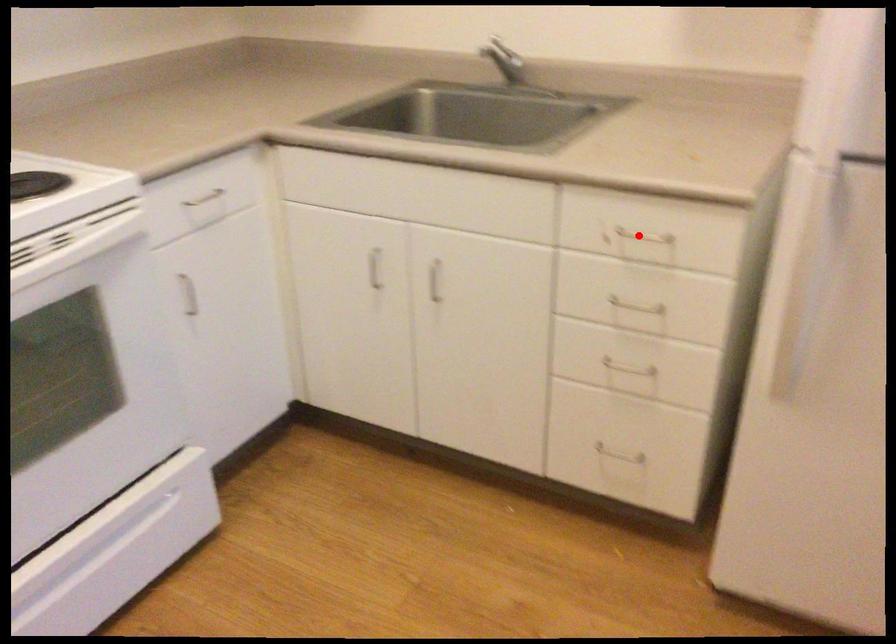
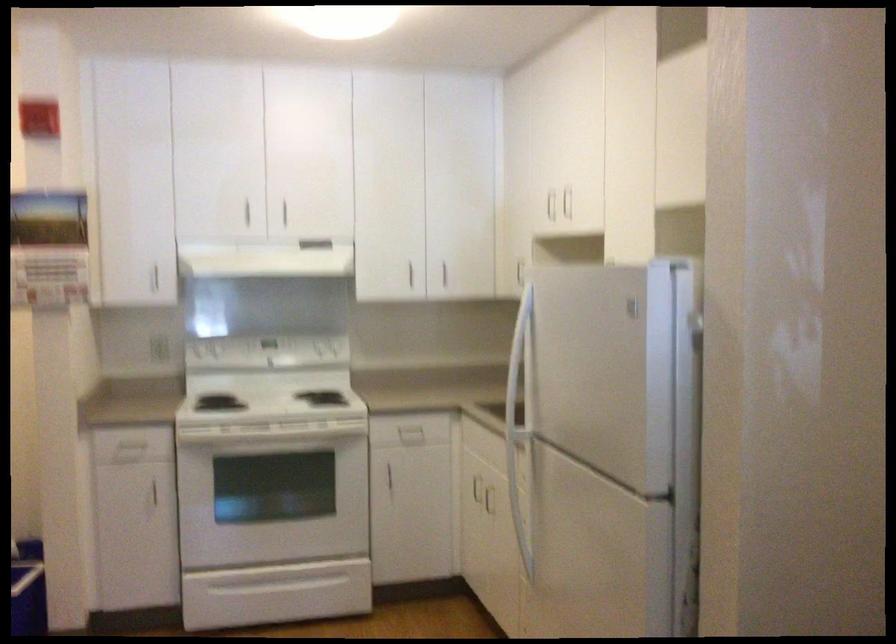
Question: I am providing you with two images of the same scene from different viewpoints. A red point is marked on the first image. Can you still see the location of the red point in image 2?

Choices:
 (A) Yes
 (B) No

Answer: (B)